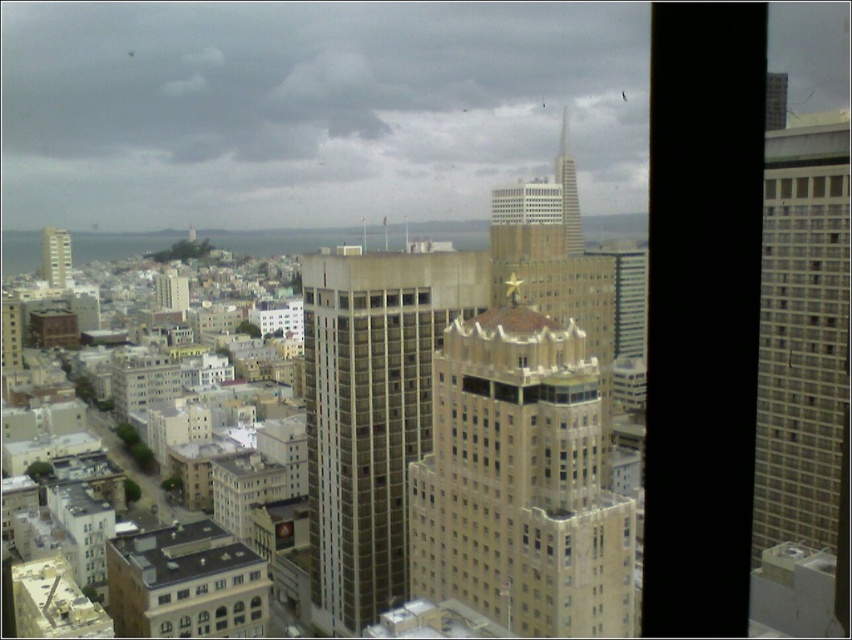
Question: Is beige stone tower at center below light beige concrete building at left?

Choices:
 (A) yes
 (B) no

Answer: (A)

Question: Is beige stone skyscraper at upper center behind smooth glass skyscraper at upper right?

Choices:
 (A) no
 (B) yes

Answer: (B)

Question: Based on their relative distances, which object is farther from the smooth glass skyscraper at upper right?

Choices:
 (A) light beige concrete building at left
 (B) beige concrete building at center
 (C) beige stone tower at center
 (D) beige stone skyscraper at upper center

Answer: (A)

Question: Is beige concrete building at center to the right of light beige concrete building at left from the viewer's perspective?

Choices:
 (A) yes
 (B) no

Answer: (A)

Question: Which point is farther from the camera taking this photo?

Choices:
 (A) pos(309,316)
 (B) pos(563,109)
 (C) pos(47,243)

Answer: (B)

Question: Which point is closer to the camera?

Choices:
 (A) 532,548
 (B) 786,108
 (C) 568,180

Answer: (A)